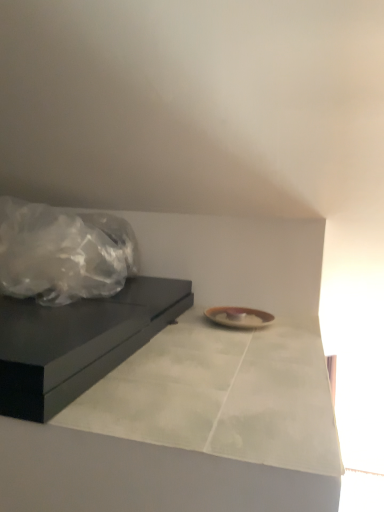
Question: Which is correct: matte black table at left is inside white marble countertop at center, or outside of it?

Choices:
 (A) outside
 (B) inside

Answer: (A)

Question: Considering the relative positions of matte black table at left and white marble countertop at center in the image provided, is matte black table at left to the left or to the right of white marble countertop at center?

Choices:
 (A) left
 (B) right

Answer: (A)

Question: From the image's perspective, relative to white marble countertop at center, is matte black table at left above or below?

Choices:
 (A) above
 (B) below

Answer: (A)

Question: Visually, is white marble countertop at center positioned to the left or to the right of matte black table at left?

Choices:
 (A) left
 (B) right

Answer: (B)

Question: Choose the correct answer: Is white marble countertop at center inside matte black table at left or outside it?

Choices:
 (A) outside
 (B) inside

Answer: (A)

Question: Is point (243, 488) closer or farther from the camera than point (29, 359)?

Choices:
 (A) farther
 (B) closer

Answer: (B)

Question: In terms of width, does white marble countertop at center look wider or thinner when compared to matte black table at left?

Choices:
 (A) thin
 (B) wide

Answer: (A)